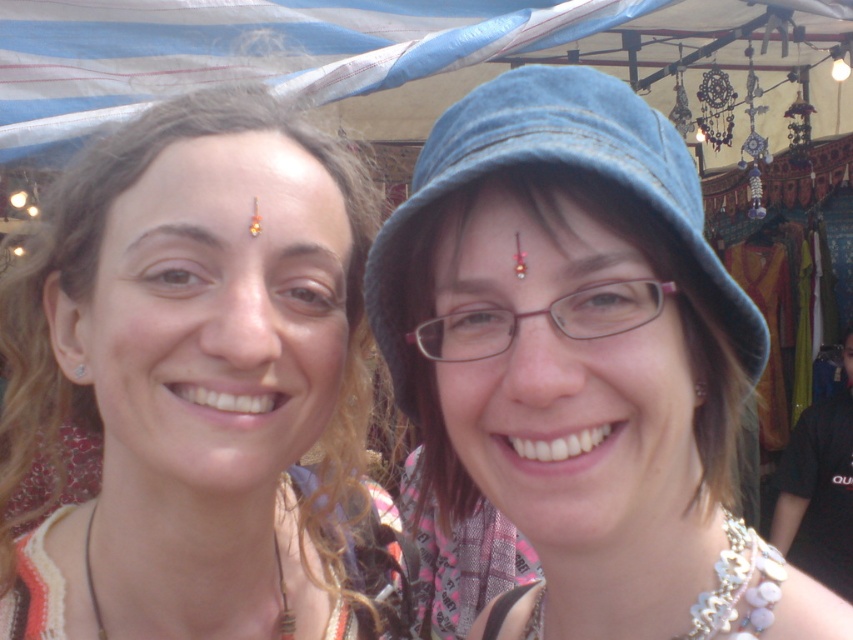
You are a photographer at the market and want to capture a closeup of the matte gold forehead at center without the leather cord necklace at lower left appearing in the frame. How should you adjust your camera angle?

The matte gold forehead at center is positioned over the leather cord necklace at lower left, so tilting the camera slightly upward would allow you to focus on the matte gold forehead at center while avoiding the necklace below.

You are a photographer trying to capture the perfect shot of the denim blue hat at center. The camera you are using has a focal point at point A located at coordinates (556,164). Will the hat be in focus if you set the focal point to point A?

Yes, the denim blue hat at center is represented by point (556,164), so setting the focal point to that coordinate will ensure the hat is in focus.